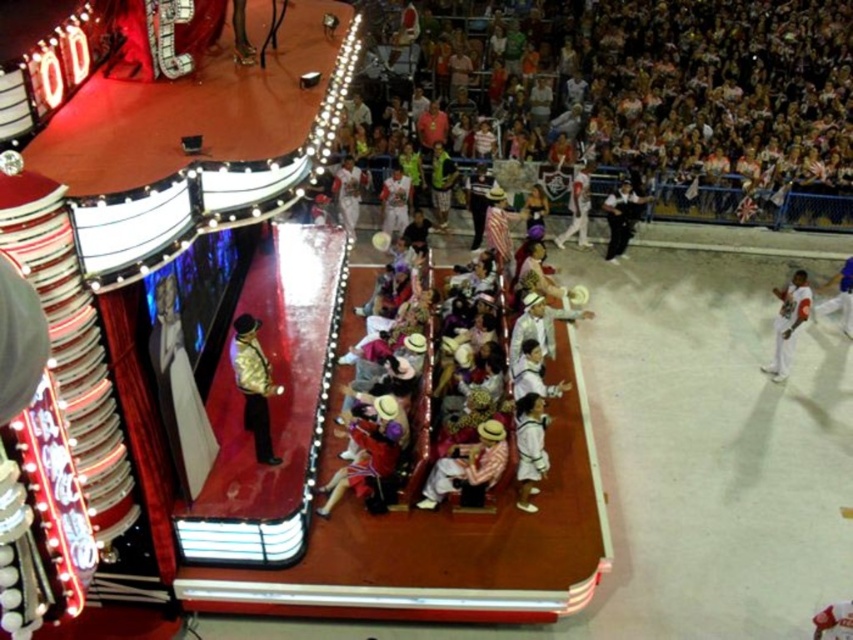
Does white cotton shirt at upper right have a larger size compared to white cotton pants at center?

No, white cotton shirt at upper right is not bigger than white cotton pants at center.

In the scene shown: Can you confirm if white cotton shirt at upper right is positioned below white cotton pants at center?

Correct, white cotton shirt at upper right is located below white cotton pants at center.

What do you see at coordinates (621, 218) in the screenshot? I see `white cotton shirt at upper right` at bounding box center [621, 218].

This screenshot has width=853, height=640. I want to click on white cotton shirt at upper right, so click(621, 218).

Can you confirm if white baseball uniform at right is positioned above white cotton shirt at upper right?

No, white baseball uniform at right is not above white cotton shirt at upper right.

Identify the location of white baseball uniform at right. (788, 321).

Where is `white baseball uniform at right`? white baseball uniform at right is located at coordinates (788, 321).

Is white baseball uniform at right bigger than white cotton pants at center?

Indeed, white baseball uniform at right has a larger size compared to white cotton pants at center.

Which of these two, white baseball uniform at right or white cotton pants at center, stands taller?

Standing taller between the two is white cotton pants at center.

Is point (782, 369) farther from camera compared to point (583, 192)?

No, (782, 369) is in front of (583, 192).

Find the location of `white baseball uniform at right`. white baseball uniform at right is located at coordinates (788, 321).